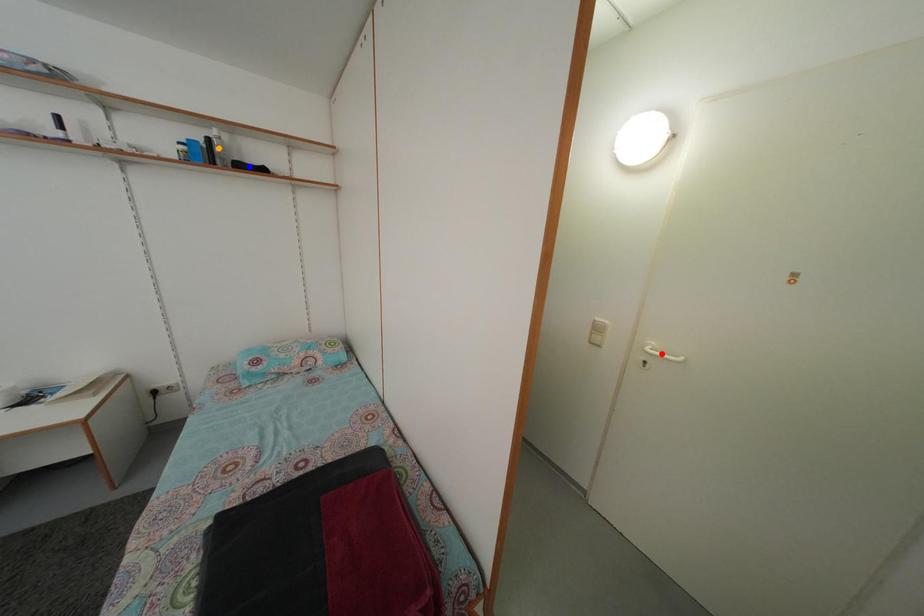
Order these from nearest to farthest:
red point
blue point
orange point

red point < orange point < blue point